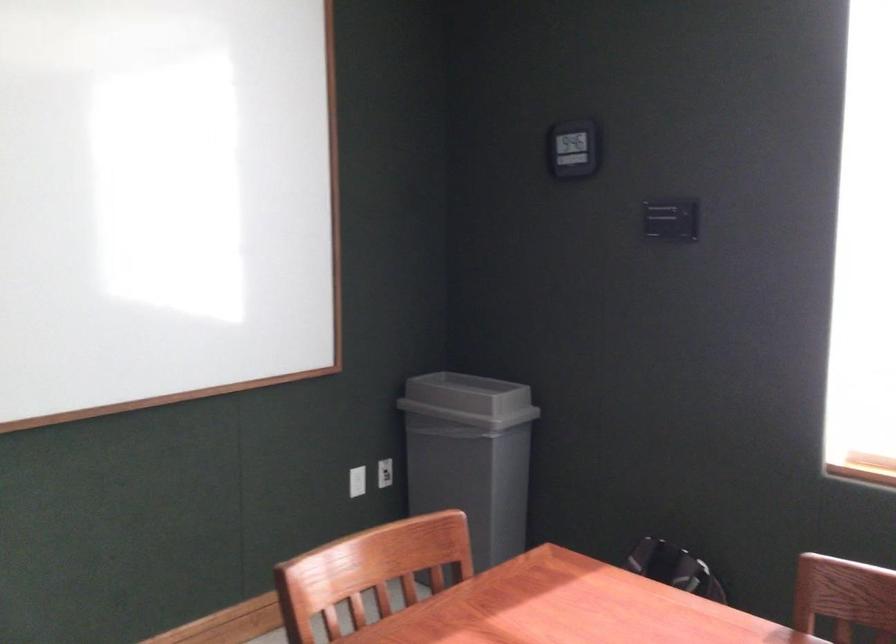
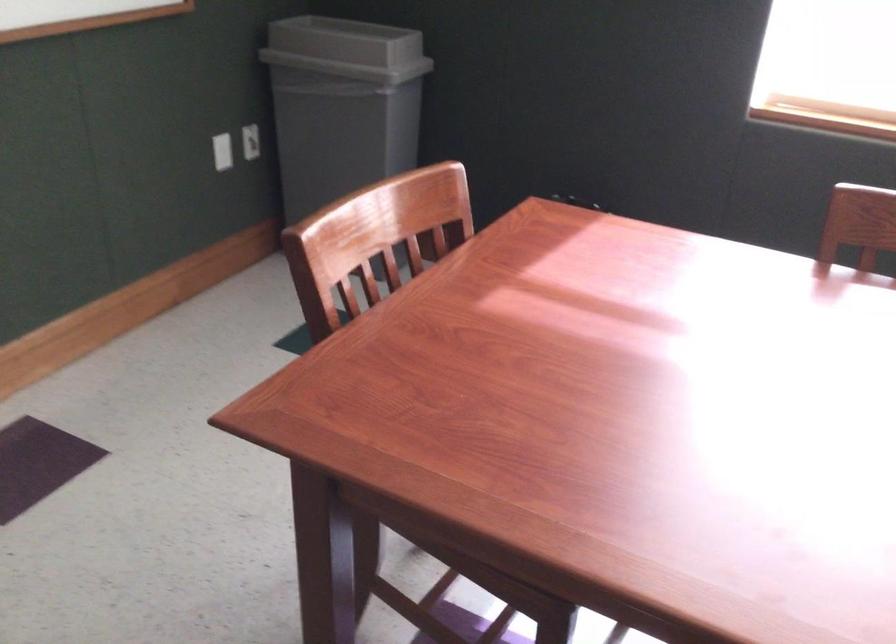
Find the pixel in the second image that matches pixel 459 401 in the first image.

(346, 49)